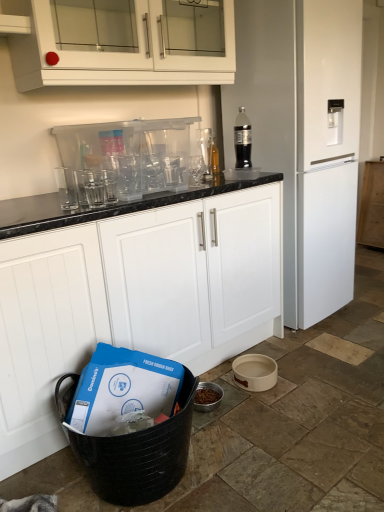
This screenshot has width=384, height=512. Describe the element at coordinates (133, 300) in the screenshot. I see `white matte cabinet at center, which is counted as the 3th cabinetry, starting from the back` at that location.

Describe the element at coordinates (242, 140) in the screenshot. The width and height of the screenshot is (384, 512). I see `clear plastic bottle at upper right, which is the 2th bottle in back-to-front order` at that location.

The image size is (384, 512). Identify the location of white glossy cabinet at upper center, which is the 2th cabinetry from front to back. (123, 42).

I want to click on white ceramic bowl at lower right, acting as the 1th appliance starting from the bottom, so click(255, 372).

Which is in front, point (241, 364) or point (186, 14)?

The point (241, 364) is more forward.

Between white ceramic bowl at lower right, which is the 1th appliance from right to left, and white glossy cabinet at upper center, acting as the 2th cabinetry starting from the back, which one has smaller width?

white ceramic bowl at lower right, which is the 1th appliance from right to left, is thinner.

Considering the positions of objects white ceramic bowl at lower right, the second appliance when ordered from left to right, and white glossy cabinet at upper center, the 2th cabinetry from the right, in the image provided, who is in front, white ceramic bowl at lower right, the second appliance when ordered from left to right, or white glossy cabinet at upper center, the 2th cabinetry from the right,?

white glossy cabinet at upper center, the 2th cabinetry from the right, is closer to the camera.

From the image's perspective, which one is positioned higher, white matte cabinet at center, acting as the third cabinetry starting from the right, or white matte cabinet at right, the 1th cabinetry when ordered from right to left?

From the image's view, white matte cabinet at right, the 1th cabinetry when ordered from right to left, is above.

Between point (199, 266) and point (373, 208), which one is positioned in front?

The point (199, 266) is in front.

Who is bigger, white matte cabinet at center, which is the 1th cabinetry in left-to-right order, or white matte cabinet at right, the 1th cabinetry viewed from the back?

With larger size is white matte cabinet at center, which is the 1th cabinetry in left-to-right order.

Looking at their sizes, would you say white matte cabinet at center, which is counted as the 3th cabinetry, starting from the back, is wider or thinner than white matte cabinet at right, arranged as the third cabinetry when viewed from the left?

In the image, white matte cabinet at center, which is counted as the 3th cabinetry, starting from the back, appears to be wider than white matte cabinet at right, arranged as the third cabinetry when viewed from the left.

From the image's perspective, is white matte cabinet at center, acting as the third cabinetry starting from the right, above or below translucent glass bottle at upper center, which appears as the 2th bottle when viewed from the right?

From the image's perspective, white matte cabinet at center, acting as the third cabinetry starting from the right, appears below translucent glass bottle at upper center, which appears as the 2th bottle when viewed from the right.

Is translucent glass bottle at upper center, acting as the first bottle starting from the left, completely or partially inside white matte cabinet at center, which is the 1th cabinetry in front-to-back order?

That's incorrect, translucent glass bottle at upper center, acting as the first bottle starting from the left, is not inside white matte cabinet at center, which is the 1th cabinetry in front-to-back order.

Looking at this image, which of these two, white matte cabinet at center, acting as the third cabinetry starting from the right, or translucent glass bottle at upper center, which appears as the 2th bottle when viewed from the right, is thinner?

Thinner between the two is translucent glass bottle at upper center, which appears as the 2th bottle when viewed from the right.

Is the depth of white matte cabinet at center, which is the 1th cabinetry in left-to-right order, less than that of translucent glass bottle at upper center, acting as the first bottle starting from the left?

Yes.

Are white matte cabinet at right, arranged as the third cabinetry when viewed from the left, and translucent glass bottle at upper center, which appears as the 2th bottle when viewed from the right, making contact?

white matte cabinet at right, arranged as the third cabinetry when viewed from the left, and translucent glass bottle at upper center, which appears as the 2th bottle when viewed from the right, are not in contact.

Is point (365, 230) closer or farther from the camera than point (214, 170)?

Clearly, point (365, 230) is more distant from the camera than point (214, 170).

Between white matte cabinet at right, the 1th cabinetry when ordered from right to left, and translucent glass bottle at upper center, acting as the first bottle starting from the left, which one appears on the left side from the viewer's perspective?

translucent glass bottle at upper center, acting as the first bottle starting from the left, is more to the left.

From the image's perspective, which one is positioned higher, white matte cabinet at right, the 3th cabinetry positioned from the front, or translucent glass bottle at upper center, which appears as the 2th bottle when viewed from the right?

translucent glass bottle at upper center, which appears as the 2th bottle when viewed from the right, from the image's perspective.

Between white matte refrigerator at right and white matte cabinet at right, the 1th cabinetry viewed from the back, which one has more height?

Standing taller between the two is white matte refrigerator at right.

Does white matte refrigerator at right contain white matte cabinet at right, the 1th cabinetry when ordered from right to left?

Actually, white matte cabinet at right, the 1th cabinetry when ordered from right to left, is outside white matte refrigerator at right.

Is white matte refrigerator at right oriented towards white matte cabinet at right, the 1th cabinetry when ordered from right to left?

No.

Is white glossy cabinet at upper center, which is the 2th cabinetry from front to back, inside the boundaries of white matte cabinet at center, which is the 1th cabinetry in left-to-right order, or outside?

white glossy cabinet at upper center, which is the 2th cabinetry from front to back, is outside white matte cabinet at center, which is the 1th cabinetry in left-to-right order.

From the picture: Considering the positions of objects white glossy cabinet at upper center, which is the 2th cabinetry from front to back, and white matte cabinet at center, acting as the third cabinetry starting from the right, in the image provided, who is more to the left, white glossy cabinet at upper center, which is the 2th cabinetry from front to back, or white matte cabinet at center, acting as the third cabinetry starting from the right,?

Positioned to the left is white matte cabinet at center, acting as the third cabinetry starting from the right.

Is white glossy cabinet at upper center, which is the 2th cabinetry from left to right, bigger than white matte cabinet at center, which is the 1th cabinetry in front-to-back order?

Incorrect, white glossy cabinet at upper center, which is the 2th cabinetry from left to right, is not larger than white matte cabinet at center, which is the 1th cabinetry in front-to-back order.

From a real-world perspective, is white glossy cabinet at upper center, which is the 2th cabinetry from left to right, below white matte cabinet at center, which is the 1th cabinetry in front-to-back order?

No, from a real-world perspective, white glossy cabinet at upper center, which is the 2th cabinetry from left to right, is not under white matte cabinet at center, which is the 1th cabinetry in front-to-back order.

How different are the orientations of white glossy cabinet at upper center, which is the 2th cabinetry from left to right, and white ceramic bowl at lower right, which is the 1th appliance from right to left, in degrees?

They differ by 1.22 degrees in their facing directions.

Between white glossy cabinet at upper center, which is the 2th cabinetry from left to right, and white ceramic bowl at lower right, the second appliance when ordered from left to right, which one has smaller size?

white ceramic bowl at lower right, the second appliance when ordered from left to right, is smaller.

Find the location of a particular element. Image resolution: width=384 pixels, height=512 pixels. appliance on the right of white glossy cabinet at upper center, the 2th cabinetry from the right is located at coordinates (255, 372).

Find the location of a particular element. Image resolution: width=384 pixels, height=512 pixels. cabinetry that is the 1st one when counting forward from the white ceramic bowl at lower right, which is the 2th appliance in top-to-bottom order is located at coordinates (123, 42).

I want to click on cabinetry that is the 2nd object to the right of the white matte cabinet at center, which is the 1th cabinetry in left-to-right order, starting at the anchor, so click(372, 206).

When comparing their distances from white matte cabinet at center, which is counted as the 3th cabinetry, starting from the back, does clear plastic bottle at upper right, marked as the second bottle in a left-to-right arrangement, or transparent plastic glasses at upper center, which appears as the 2th appliance when viewed from the right, seem closer?

transparent plastic glasses at upper center, which appears as the 2th appliance when viewed from the right, is positioned closer to the anchor white matte cabinet at center, which is counted as the 3th cabinetry, starting from the back.

Based on their spatial positions, is white matte cabinet at center, which is the 1th cabinetry in front-to-back order, or white glossy cabinet at upper center, the 2th cabinetry from the right, further from translucent glass bottle at upper center, acting as the first bottle starting from the left?

The object further to translucent glass bottle at upper center, acting as the first bottle starting from the left, is white matte cabinet at center, which is the 1th cabinetry in front-to-back order.

Estimate the real-world distances between objects in this image. Which object is closer to white matte cabinet at center, acting as the third cabinetry starting from the right, clear plastic bottle at upper right, placed as the first bottle when sorted from right to left, or white glossy cabinet at upper center, acting as the 2th cabinetry starting from the back?

white glossy cabinet at upper center, acting as the 2th cabinetry starting from the back, is positioned closer to the anchor white matte cabinet at center, acting as the third cabinetry starting from the right.

Which object lies nearer to the anchor point white matte refrigerator at right, translucent glass bottle at upper center, which appears as the 2th bottle when viewed from the right, or white matte cabinet at center, which is the 1th cabinetry in front-to-back order?

Among the two, translucent glass bottle at upper center, which appears as the 2th bottle when viewed from the right, is located nearer to white matte refrigerator at right.

In the scene shown: When comparing their distances from white glossy cabinet at upper center, the 2th cabinetry from the right, does transparent plastic glasses at upper center, which appears as the 2th appliance when viewed from the right, or white matte refrigerator at right seem closer?

Based on the image, transparent plastic glasses at upper center, which appears as the 2th appliance when viewed from the right, appears to be nearer to white glossy cabinet at upper center, the 2th cabinetry from the right.

Which object lies further to the anchor point clear plastic bottle at upper right, marked as the second bottle in a left-to-right arrangement, transparent plastic glasses at upper center, the 1th appliance from the left, or white matte cabinet at right, the 3th cabinetry positioned from the front?

white matte cabinet at right, the 3th cabinetry positioned from the front, is positioned further to the anchor clear plastic bottle at upper right, marked as the second bottle in a left-to-right arrangement.

Based on their spatial positions, is translucent glass bottle at upper center, which appears as the 2th bottle when viewed from the right, or white ceramic bowl at lower right, acting as the 1th appliance starting from the bottom, closer to white matte refrigerator at right?

translucent glass bottle at upper center, which appears as the 2th bottle when viewed from the right, is closer to white matte refrigerator at right.

When comparing their distances from clear plastic bottle at upper right, marked as the second bottle in a left-to-right arrangement, does translucent glass bottle at upper center, acting as the first bottle starting from the left, or white matte cabinet at center, which is the 1th cabinetry in left-to-right order, seem closer?

translucent glass bottle at upper center, acting as the first bottle starting from the left, lies closer to clear plastic bottle at upper right, marked as the second bottle in a left-to-right arrangement, than the other object.

Image resolution: width=384 pixels, height=512 pixels. Find the location of `appliance between white matte refrigerator at right and white ceramic bowl at lower right, the second appliance when ordered from left to right, in the vertical direction`. appliance between white matte refrigerator at right and white ceramic bowl at lower right, the second appliance when ordered from left to right, in the vertical direction is located at coordinates (127, 158).

Locate an element on the screen. This screenshot has height=512, width=384. home appliance between clear plastic bottle at upper right, placed as the first bottle when sorted from right to left, and white ceramic bowl at lower right, the second appliance when ordered from left to right, vertically is located at coordinates (304, 137).

I want to click on home appliance positioned between white matte cabinet at center, acting as the third cabinetry starting from the right, and translucent glass bottle at upper center, which ranks as the 2th bottle in front-to-back order, from near to far, so click(x=304, y=137).

This screenshot has width=384, height=512. What are the coordinates of `home appliance between transparent plastic glasses at upper center, positioned as the 1th appliance in top-to-bottom order, and white matte cabinet at right, the 3th cabinetry positioned from the front, from front to back` in the screenshot? It's located at (304, 137).